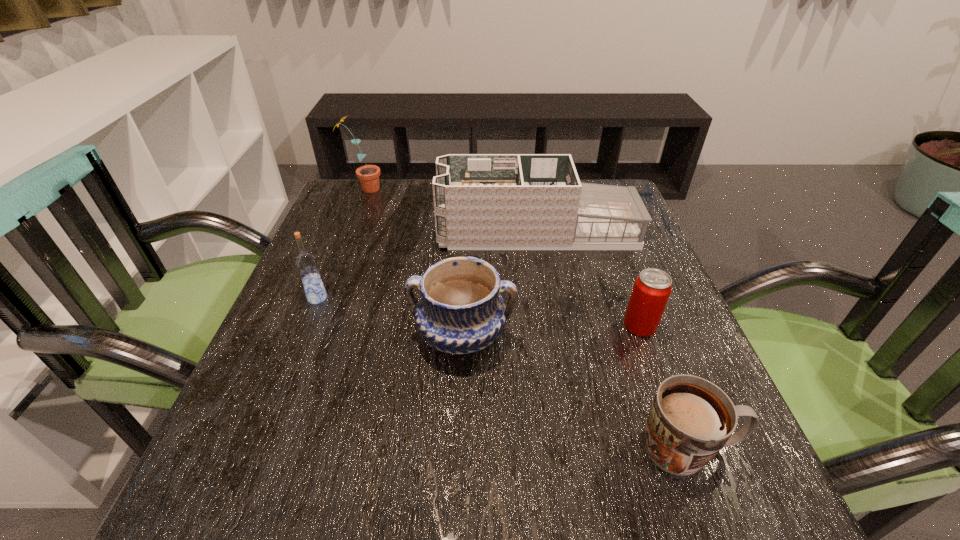
Locate an element on the screen. The width and height of the screenshot is (960, 540). vacant space located 0.200m at the entrance of the second farthest object is located at coordinates (356, 232).

The image size is (960, 540). I want to click on free space located 0.100m on the front of the vodka, so click(x=300, y=344).

At what (x,y) coordinates should I click in order to perform the action: click on vacant point located 0.260m on the back of the pottery. Please return your answer as a coordinate pair (x, y). This screenshot has width=960, height=540. Looking at the image, I should click on (467, 230).

Find the location of a particular element. This screenshot has height=540, width=960. vacant area located on the back of the can is located at coordinates (614, 256).

The image size is (960, 540). In order to click on sunflower situated at the far edge in this screenshot , I will do `click(368, 175)`.

Where is `dollhouse at the far edge`? dollhouse at the far edge is located at coordinates click(481, 201).

Locate an element on the screen. The width and height of the screenshot is (960, 540). object that is at the near edge is located at coordinates (690, 420).

Locate an element on the screen. sunflower located in the left edge section of the desktop is located at coordinates (368, 175).

You are a GUI agent. You are given a task and a screenshot of the screen. Output one action in this format:
    pyautogui.click(x=<x>, y=<y>)
    Task: Click on the vodka that is at the left edge
    This screenshot has width=960, height=540.
    Given the screenshot: What is the action you would take?
    pos(306,263)

The image size is (960, 540). I want to click on dollhouse present at the right edge, so click(481, 201).